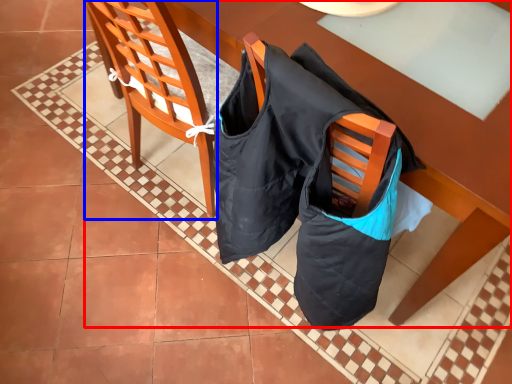
Question: Which point is further to the camera, table (highlighted by a red box) or chair (highlighted by a blue box)?

Choices:
 (A) table
 (B) chair

Answer: (A)